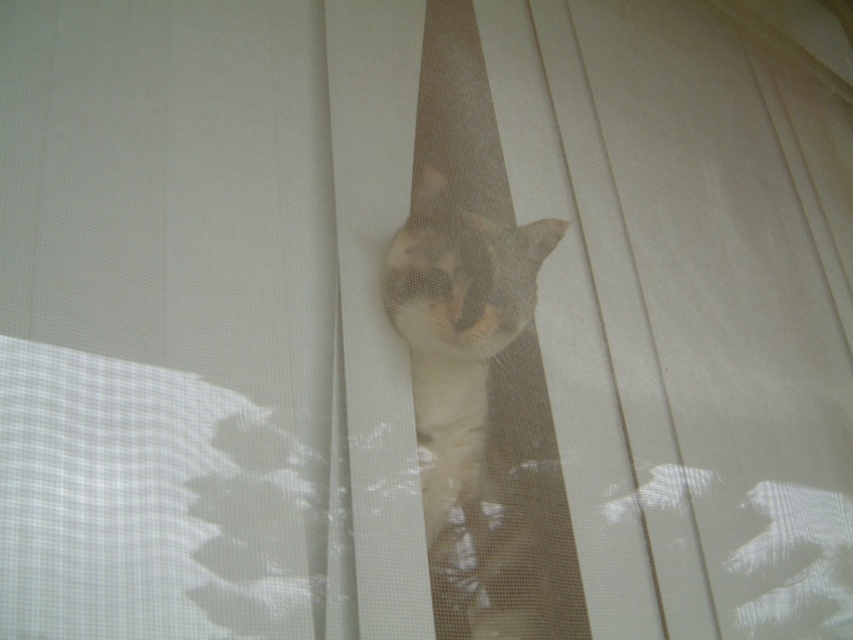
Question: Does white sheer curtain at center have a smaller size compared to light brown fur cat at center?

Choices:
 (A) yes
 (B) no

Answer: (B)

Question: Does white sheer curtain at center appear on the right side of light brown fur cat at center?

Choices:
 (A) yes
 (B) no

Answer: (B)

Question: Where is white sheer curtain at center located in relation to light brown fur cat at center in the image?

Choices:
 (A) left
 (B) right

Answer: (A)

Question: Which of the following is the farthest from the observer?

Choices:
 (A) white sheer curtain at center
 (B) light brown fur cat at center

Answer: (B)